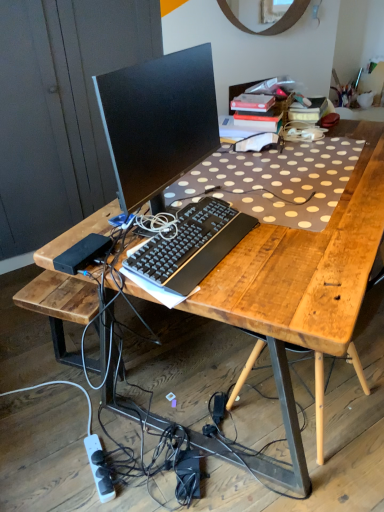
This screenshot has height=512, width=384. What are the coordinates of `free spot in front of white plastic power strip at lower left` in the screenshot? It's located at (85, 497).